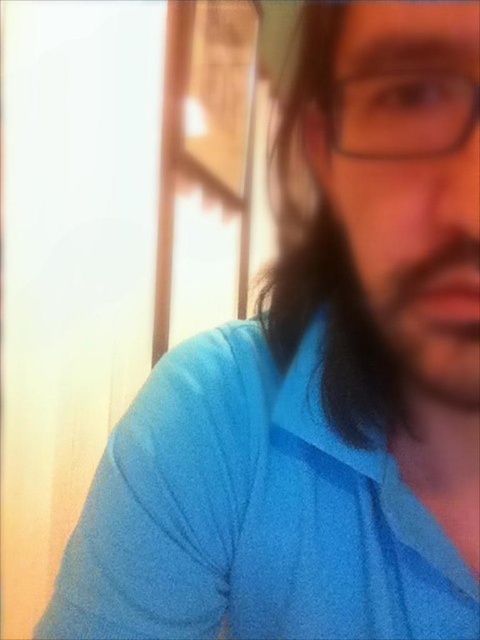
Can you confirm if dark brown silky hair at center is thinner than transparent plastic glasses at center?

No, dark brown silky hair at center is not thinner than transparent plastic glasses at center.

Can you confirm if dark brown silky hair at center is positioned to the right of transparent plastic glasses at center?

No, dark brown silky hair at center is not to the right of transparent plastic glasses at center.

In order to click on dark brown silky hair at center in this screenshot , I will do click(325, 269).